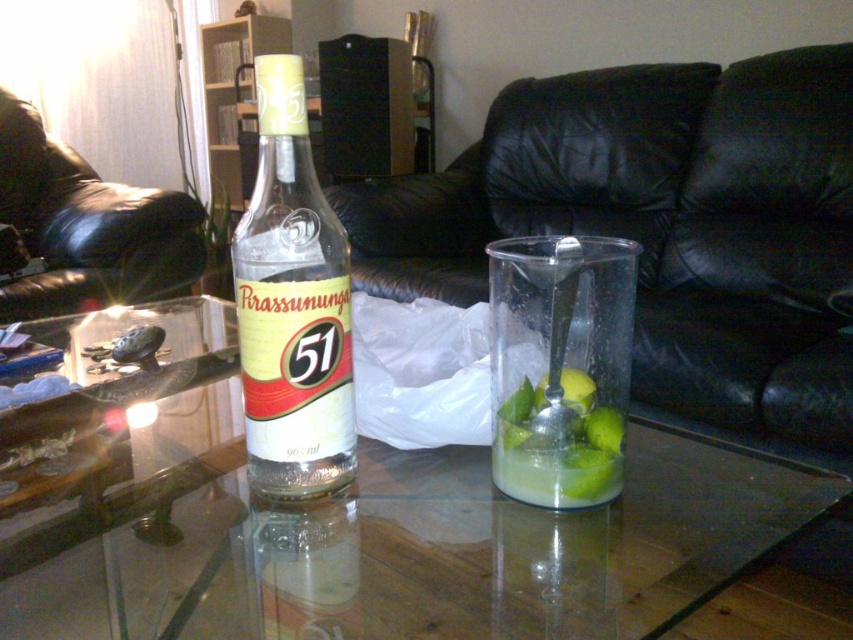
Question: Considering the real-world distances, which object is closest to the clear glass bottle at center?

Choices:
 (A) green matte lime at center
 (B) black leather couch at left
 (C) black leather couch at center

Answer: (A)

Question: Is black leather couch at center positioned in front of black leather couch at left?

Choices:
 (A) no
 (B) yes

Answer: (B)

Question: Is transparent glass table at center to the right of clear glass bottle at center from the viewer's perspective?

Choices:
 (A) no
 (B) yes

Answer: (A)

Question: Which object is closer to the camera taking this photo?

Choices:
 (A) green matte lime at center
 (B) transparent glass table at center
 (C) clear glass bottle at center
 (D) black leather couch at center

Answer: (B)

Question: Is transparent glass table at center bigger than black leather couch at center?

Choices:
 (A) yes
 (B) no

Answer: (B)

Question: Considering the real-world distances, which object is closest to the clear glass bottle at center?

Choices:
 (A) transparent glass table at center
 (B) black leather couch at left

Answer: (A)